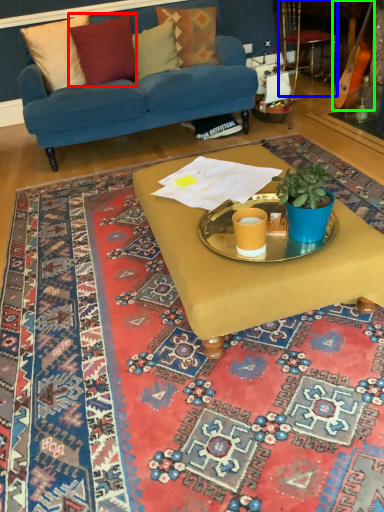
Question: Which object is positioned closest to pillow (highlighted by a red box)? Select from armchair (highlighted by a blue box) and instrument (highlighted by a green box).

Choices:
 (A) armchair
 (B) instrument

Answer: (A)